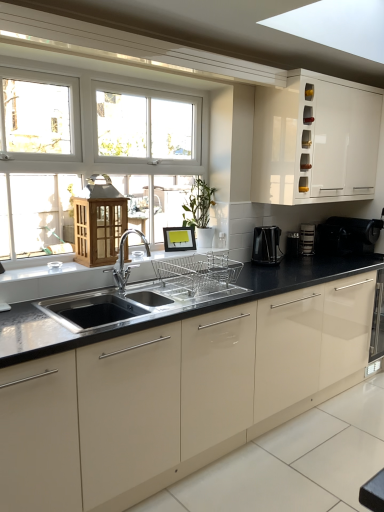
Measure the distance between point (289,234) and camera.

A distance of 10.70 feet exists between point (289,234) and camera.

Locate an element on the screen. This screenshot has height=512, width=384. black plastic coffee maker at right, which is the 1th appliance from right to left is located at coordinates (348, 234).

The height and width of the screenshot is (512, 384). In order to click on black glossy countertop at center in this screenshot , I will do `click(180, 387)`.

Is black plastic coffee machine at right, which ranks as the first coffee machine in front-to-back order, to the left of polished chrome faucet at center from the viewer's perspective?

In fact, black plastic coffee machine at right, which ranks as the first coffee machine in front-to-back order, is to the right of polished chrome faucet at center.

From the image's perspective, is black plastic coffee machine at right, marked as the first coffee machine in a left-to-right arrangement, located above polished chrome faucet at center?

Indeed, from the image's perspective, black plastic coffee machine at right, marked as the first coffee machine in a left-to-right arrangement, is shown above polished chrome faucet at center.

Who is taller, black plastic coffee machine at right, which is the 2th coffee machine in right-to-left order, or polished chrome faucet at center?

Standing taller between the two is polished chrome faucet at center.

Is black plastic coffee machine at right, marked as the first coffee machine in a left-to-right arrangement, facing away from polished chrome faucet at center?

No, black plastic coffee machine at right, marked as the first coffee machine in a left-to-right arrangement, is not facing away from polished chrome faucet at center.

Is the depth of black plastic coffee machine at right, the first coffee machine viewed from the right, less than that of polished chrome faucet at center?

That is False.

From a real-world perspective, is black plastic coffee machine at right, which is counted as the second coffee machine, starting from the front, physically above polished chrome faucet at center?

No, from a real-world perspective, black plastic coffee machine at right, which is counted as the second coffee machine, starting from the front, is not on top of polished chrome faucet at center.

Who is shorter, black plastic coffee machine at right, which is the second coffee machine in left-to-right order, or polished chrome faucet at center?

black plastic coffee machine at right, which is the second coffee machine in left-to-right order.

Is polished chrome faucet at center at the back of black plastic coffee machine at right, which is the second coffee machine in left-to-right order?

No.

Does black plastic coffee maker at right, which is the 1th appliance from right to left, have a greater width compared to black plastic coffee machine at right, which is the 2th coffee machine in right-to-left order?

Yes, black plastic coffee maker at right, which is the 1th appliance from right to left, is wider than black plastic coffee machine at right, which is the 2th coffee machine in right-to-left order.

At what (x,y) coordinates should I click in order to perform the action: click on coffee machine that is the 1st one below the black plastic coffee maker at right, which appears as the second appliance when viewed from the left (from a real-world perspective). Please return your answer as a coordinate pair (x, y). Looking at the image, I should click on (266, 245).

Is black plastic coffee maker at right, which is the 1th appliance from right to left, oriented towards black plastic coffee machine at right, which ranks as the 2th coffee machine in back-to-front order?

No, black plastic coffee maker at right, which is the 1th appliance from right to left, is not turned towards black plastic coffee machine at right, which ranks as the 2th coffee machine in back-to-front order.

Is black plastic coffee maker at right, which appears as the second appliance when viewed from the left, not near black plastic coffee machine at right, which is the 2th coffee machine in right-to-left order?

No, black plastic coffee maker at right, which appears as the second appliance when viewed from the left, is in close proximity to black plastic coffee machine at right, which is the 2th coffee machine in right-to-left order.

How far apart are polished chrome faucet at center and black plastic coffee maker at center right, marked as the second appliance in a right-to-left arrangement?

They are 4.43 feet apart.

From the image's perspective, who appears lower, polished chrome faucet at center or black plastic coffee maker at center right, marked as the second appliance in a right-to-left arrangement?

From the image's view, polished chrome faucet at center is below.

At what (x,y) coordinates should I click in order to perform the action: click on tap above the black plastic coffee maker at center right, the first appliance in the left-to-right sequence (from a real-world perspective). Please return your answer as a coordinate pair (x, y). The image size is (384, 512). Looking at the image, I should click on (123, 260).

Which of these two, black plastic coffee machine at right, the first coffee machine viewed from the right, or white glossy cabinet at upper right, is wider?

white glossy cabinet at upper right.

In the scene shown: From the image's perspective, is black plastic coffee machine at right, which is counted as the second coffee machine, starting from the front, positioned above or below white glossy cabinet at upper right?

black plastic coffee machine at right, which is counted as the second coffee machine, starting from the front, is below white glossy cabinet at upper right.

In the scene shown: From a real-world perspective, does black plastic coffee machine at right, which is counted as the second coffee machine, starting from the front, stand above white glossy cabinet at upper right?

Actually, black plastic coffee machine at right, which is counted as the second coffee machine, starting from the front, is physically below white glossy cabinet at upper right in the real world.

Is black plastic coffee machine at right, the first coffee machine in the back-to-front sequence, next to white glossy cabinet at upper right?

No, black plastic coffee machine at right, the first coffee machine in the back-to-front sequence, is not next to white glossy cabinet at upper right.

Does black plastic coffee machine at right, which is the second coffee machine in left-to-right order, have a larger size compared to black glossy countertop at center?

No.

What's the angular difference between black plastic coffee machine at right, which is counted as the second coffee machine, starting from the front, and black glossy countertop at center's facing directions?

There is a 0.518-degree angle between the facing directions of black plastic coffee machine at right, which is counted as the second coffee machine, starting from the front, and black glossy countertop at center.

Looking at this image, would you say black plastic coffee machine at right, which is counted as the second coffee machine, starting from the front, contains black glossy countertop at center?

No, black glossy countertop at center is not a part of black plastic coffee machine at right, which is counted as the second coffee machine, starting from the front.

Is white glossy cabinet at upper right wider or thinner than black plastic coffee maker at center right, marked as the second appliance in a right-to-left arrangement?

Clearly, white glossy cabinet at upper right has more width compared to black plastic coffee maker at center right, marked as the second appliance in a right-to-left arrangement.

From a real-world perspective, relative to black plastic coffee maker at center right, the first appliance in the left-to-right sequence, is white glossy cabinet at upper right vertically above or below?

Clearly, from a real-world perspective, white glossy cabinet at upper right is above black plastic coffee maker at center right, the first appliance in the left-to-right sequence.

Considering the relative sizes of white glossy cabinet at upper right and black plastic coffee maker at center right, marked as the second appliance in a right-to-left arrangement, in the image provided, is white glossy cabinet at upper right smaller than black plastic coffee maker at center right, marked as the second appliance in a right-to-left arrangement,?

Incorrect, white glossy cabinet at upper right is not smaller in size than black plastic coffee maker at center right, marked as the second appliance in a right-to-left arrangement.

Starting from the polished chrome faucet at center, which coffee machine is the 1st one behind? Please provide its 2D coordinates.

[(266, 245)]

Locate an element on the screen. the 2nd coffee machine located beneath the polished chrome faucet at center (from a real-world perspective) is located at coordinates (307, 239).

When comparing their distances from white glossy cabinet at upper right, does black glossy countertop at center or polished chrome faucet at center seem further?

The object further to white glossy cabinet at upper right is polished chrome faucet at center.

Based on their spatial positions, is black plastic coffee maker at right, which is the 1th appliance from right to left, or black plastic coffee maker at center right, marked as the second appliance in a right-to-left arrangement, further from black plastic coffee machine at right, which is counted as the second coffee machine, starting from the front?

black plastic coffee maker at right, which is the 1th appliance from right to left, is positioned further to the anchor black plastic coffee machine at right, which is counted as the second coffee machine, starting from the front.

When comparing their distances from polished chrome faucet at center, does black glossy countertop at center or black plastic coffee maker at right, which appears as the second appliance when viewed from the left, seem closer?

black glossy countertop at center is closer to polished chrome faucet at center.

Looking at the image, which one is located further to black plastic coffee machine at right, marked as the first coffee machine in a left-to-right arrangement, white glossy cabinet at upper right or polished chrome faucet at center?

polished chrome faucet at center is positioned further to the anchor black plastic coffee machine at right, marked as the first coffee machine in a left-to-right arrangement.

When comparing their distances from black plastic coffee machine at right, which is the second coffee machine in left-to-right order, does black plastic coffee maker at right, which appears as the second appliance when viewed from the left, or black plastic coffee machine at right, which ranks as the 2th coffee machine in back-to-front order, seem further?

black plastic coffee machine at right, which ranks as the 2th coffee machine in back-to-front order.

From the image, which object appears to be nearer to black plastic coffee maker at center right, marked as the second appliance in a right-to-left arrangement, polished chrome faucet at center or white glossy cabinet at upper right?

white glossy cabinet at upper right is positioned closer to the anchor black plastic coffee maker at center right, marked as the second appliance in a right-to-left arrangement.

Considering their positions, is white glossy cabinet at upper right positioned further to black plastic coffee maker at center right, the first appliance in the left-to-right sequence, than polished chrome faucet at center?

Among the two, polished chrome faucet at center is located further to black plastic coffee maker at center right, the first appliance in the left-to-right sequence.

Which object lies further to the anchor point black plastic coffee machine at right, which is the 2th coffee machine in right-to-left order, white glossy cabinet at upper right or black glossy countertop at center?

Based on the image, black glossy countertop at center appears to be further to black plastic coffee machine at right, which is the 2th coffee machine in right-to-left order.

Locate an element on the screen. tap between white glossy cabinet at upper right and black glossy countertop at center in the vertical direction is located at coordinates (123, 260).

What are the coordinates of `cabinetry positioned between black glossy countertop at center and black plastic coffee machine at right, which ranks as the 2th coffee machine in back-to-front order, from near to far` in the screenshot? It's located at click(314, 142).

You are a GUI agent. You are given a task and a screenshot of the screen. Output one action in this format:
    pyautogui.click(x=<x>, y=<y>)
    Task: Click on the appliance between black glossy countertop at center and black plastic coffee maker at center right, the first appliance in the left-to-right sequence, in the front-back direction
    Image resolution: width=384 pixels, height=512 pixels.
    Given the screenshot: What is the action you would take?
    pyautogui.click(x=348, y=234)

At what (x,y) coordinates should I click in order to perform the action: click on tap located between black glossy countertop at center and black plastic coffee machine at right, which is counted as the second coffee machine, starting from the front, in the depth direction. Please return your answer as a coordinate pair (x, y). The width and height of the screenshot is (384, 512). Looking at the image, I should click on (123, 260).